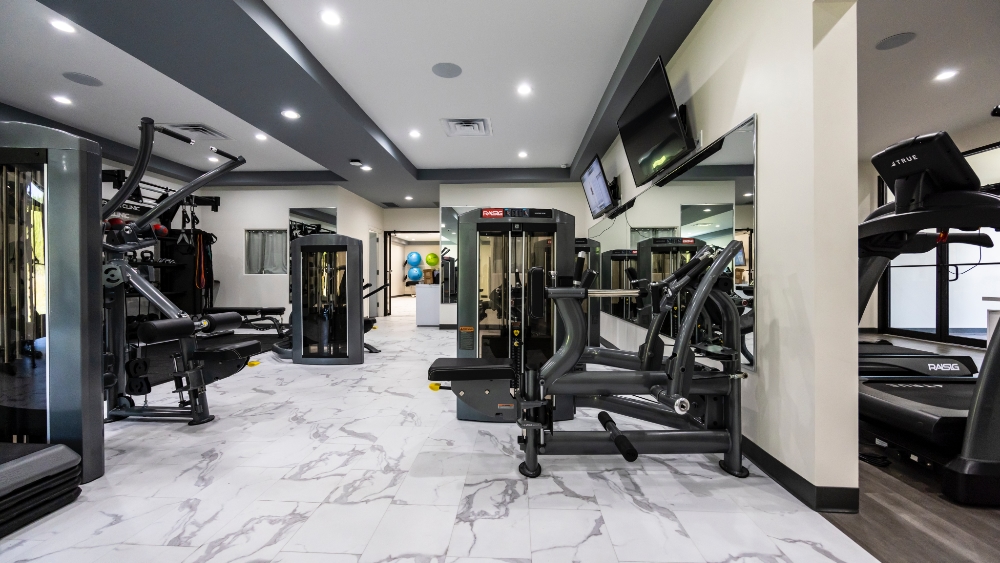
At what (x,y) coordinates should I click in order to perform the action: click on walls. Please return your answer as a coordinate pair (x, y). This screenshot has width=1000, height=563. Looking at the image, I should click on (766, 71), (545, 193), (248, 210), (113, 164), (982, 134), (867, 190).